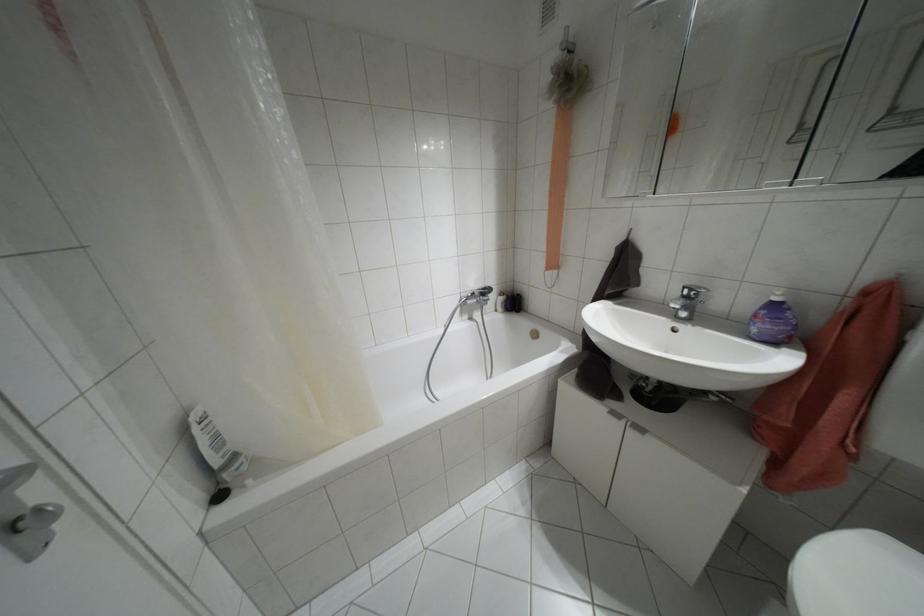
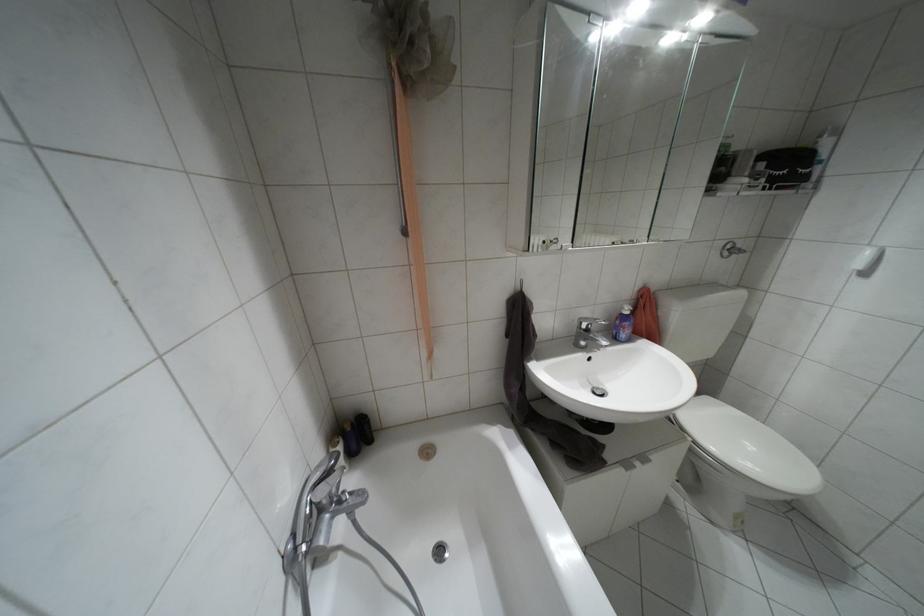
The point at (686, 297) is marked in the first image. Where is the corresponding point in the second image?

(587, 330)